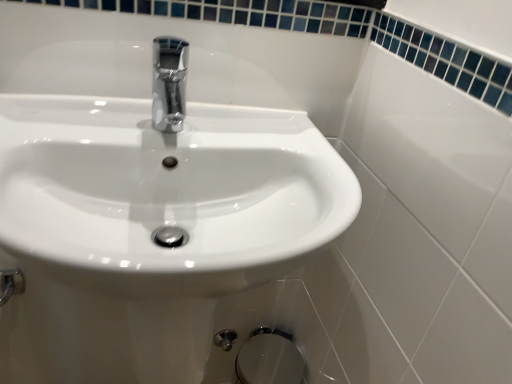
Question: Do you think white glossy sink at center is within chrome metallic faucet at center, or outside of it?

Choices:
 (A) outside
 (B) inside

Answer: (A)

Question: From a real-world perspective, is white glossy sink at center positioned above or below chrome metallic faucet at center?

Choices:
 (A) above
 (B) below

Answer: (B)

Question: Estimate the real-world distances between objects in this image. Which object is farther from the satin chrome bidet at lower center?

Choices:
 (A) chrome metallic faucet at center
 (B) white glossy sink at center

Answer: (A)

Question: Which is nearer to the white glossy sink at center?

Choices:
 (A) satin chrome bidet at lower center
 (B) chrome metallic faucet at center

Answer: (B)